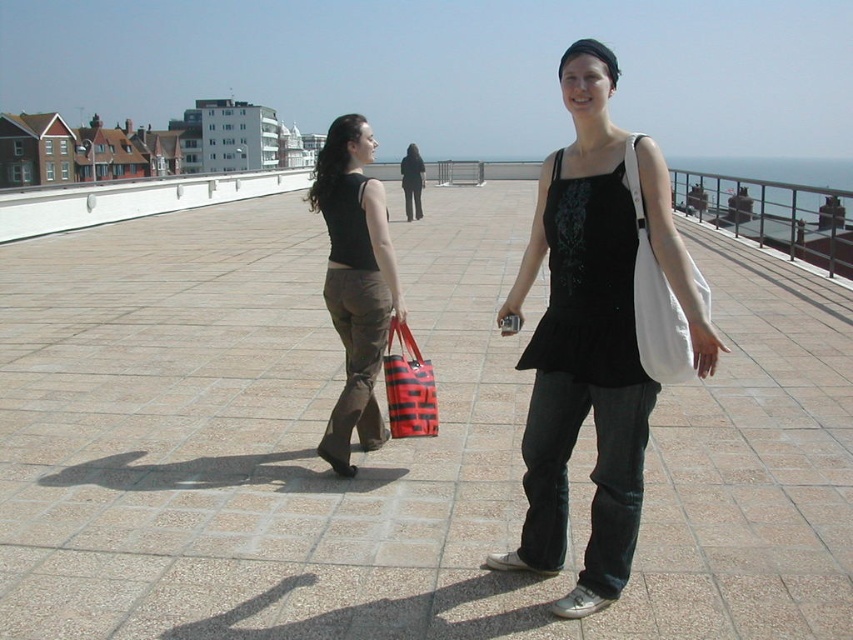
Question: Which object appears closest to the camera in this image?

Choices:
 (A) white fabric bag at center
 (B) matte black tank top at left
 (C) brown textured pavement at center
 (D) red striped fabric bag at center

Answer: (A)

Question: Can you confirm if brown textured pavement at center is bigger than white fabric bag at center?

Choices:
 (A) yes
 (B) no

Answer: (A)

Question: Which of the following is the farthest from the observer?

Choices:
 (A) red striped fabric bag at center
 (B) white fabric bag at center

Answer: (A)

Question: Does brown textured pavement at center appear over red striped fabric bag at center?

Choices:
 (A) yes
 (B) no

Answer: (A)

Question: Which of the following is the farthest from the observer?

Choices:
 (A) red striped fabric bag at center
 (B) matte black tank top at center

Answer: (A)

Question: Can you confirm if white fabric bag at center is bigger than red striped fabric bag at center?

Choices:
 (A) no
 (B) yes

Answer: (A)